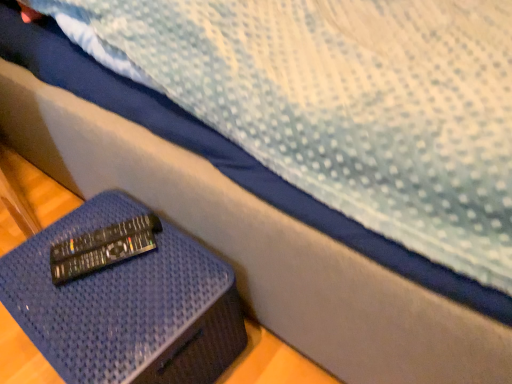
This screenshot has width=512, height=384. What are the coordinates of `vacant point to the left of black plastic remote at lower left, which is the first remote from front to back` in the screenshot? It's located at (37, 271).